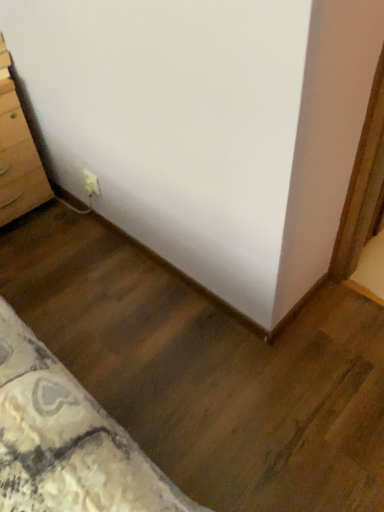
Image resolution: width=384 pixels, height=512 pixels. In order to click on white plastic outlet at lower left in this screenshot , I will do `click(91, 183)`.

The height and width of the screenshot is (512, 384). What do you see at coordinates (91, 183) in the screenshot?
I see `white plastic outlet at lower left` at bounding box center [91, 183].

This screenshot has height=512, width=384. Find the location of `light brown wooden chest of drawers at left`. light brown wooden chest of drawers at left is located at coordinates (17, 154).

What is the approximate height of light brown wooden chest of drawers at left?

It is 22.71 inches.

The image size is (384, 512). Describe the element at coordinates (17, 154) in the screenshot. I see `light brown wooden chest of drawers at left` at that location.

This screenshot has width=384, height=512. In order to click on white plastic outlet at lower left in this screenshot , I will do `click(91, 183)`.

Can you confirm if white plastic outlet at lower left is positioned to the left of light brown wooden chest of drawers at left?

No.

Considering the positions of objects white plastic outlet at lower left and light brown wooden chest of drawers at left in the image provided, who is behind, white plastic outlet at lower left or light brown wooden chest of drawers at left?

white plastic outlet at lower left is further from the camera.

Is point (91, 173) positioned behind point (1, 42)?

Yes.

From the image's perspective, which one is positioned higher, white plastic outlet at lower left or light brown wooden chest of drawers at left?

light brown wooden chest of drawers at left, from the image's perspective.

From a real-world perspective, is white plastic outlet at lower left above or below light brown wooden chest of drawers at left?

Clearly, from a real-world perspective, white plastic outlet at lower left is below light brown wooden chest of drawers at left.

In terms of width, does white plastic outlet at lower left look wider or thinner when compared to light brown wooden chest of drawers at left?

white plastic outlet at lower left is thinner than light brown wooden chest of drawers at left.

Can you confirm if white plastic outlet at lower left is shorter than light brown wooden chest of drawers at left?

Yes.

Is white plastic outlet at lower left smaller than light brown wooden chest of drawers at left?

Indeed, white plastic outlet at lower left has a smaller size compared to light brown wooden chest of drawers at left.

Is white plastic outlet at lower left located outside light brown wooden chest of drawers at left?

Absolutely, white plastic outlet at lower left is external to light brown wooden chest of drawers at left.

Can you see white plastic outlet at lower left touching light brown wooden chest of drawers at left?

No, white plastic outlet at lower left is not with light brown wooden chest of drawers at left.

Is white plastic outlet at lower left turned away from light brown wooden chest of drawers at left?

No, white plastic outlet at lower left is not facing away from light brown wooden chest of drawers at left.

I want to click on the chest of drawers located in front of the white plastic outlet at lower left, so click(17, 154).

Does light brown wooden chest of drawers at left appear on the left side of white plastic outlet at lower left?

Indeed, light brown wooden chest of drawers at left is positioned on the left side of white plastic outlet at lower left.

Which object is further away from the camera taking this photo, light brown wooden chest of drawers at left or white plastic outlet at lower left?

white plastic outlet at lower left is more distant.

Does point (22, 150) lie in front of point (88, 191)?

Yes, it is in front of point (88, 191).

From the image's perspective, which is below, light brown wooden chest of drawers at left or white plastic outlet at lower left?

white plastic outlet at lower left is shown below in the image.

From a real-world perspective, is light brown wooden chest of drawers at left on top of white plastic outlet at lower left?

Yes.

Which object is thinner, light brown wooden chest of drawers at left or white plastic outlet at lower left?

white plastic outlet at lower left.

Which of these two, light brown wooden chest of drawers at left or white plastic outlet at lower left, stands taller?

light brown wooden chest of drawers at left.

Considering the relative sizes of light brown wooden chest of drawers at left and white plastic outlet at lower left in the image provided, is light brown wooden chest of drawers at left smaller than white plastic outlet at lower left?

No.

Would you say light brown wooden chest of drawers at left is outside white plastic outlet at lower left?

Yes, light brown wooden chest of drawers at left is not within white plastic outlet at lower left.

Would you consider light brown wooden chest of drawers at left to be distant from white plastic outlet at lower left?

No, there isn't a large distance between light brown wooden chest of drawers at left and white plastic outlet at lower left.

Is light brown wooden chest of drawers at left facing towards white plastic outlet at lower left?

Yes, light brown wooden chest of drawers at left is facing white plastic outlet at lower left.

In the scene shown: Can you tell me how much light brown wooden chest of drawers at left and white plastic outlet at lower left differ in facing direction?

The angular difference between light brown wooden chest of drawers at left and white plastic outlet at lower left is 89.3 degrees.

In order to click on electric outlet behind the light brown wooden chest of drawers at left in this screenshot , I will do `click(91, 183)`.

Identify the location of chest of drawers in front of the white plastic outlet at lower left. This screenshot has width=384, height=512. (17, 154).

At what (x,y) coordinates should I click in order to perform the action: click on electric outlet on the right of light brown wooden chest of drawers at left. Please return your answer as a coordinate pair (x, y). Image resolution: width=384 pixels, height=512 pixels. Looking at the image, I should click on (91, 183).